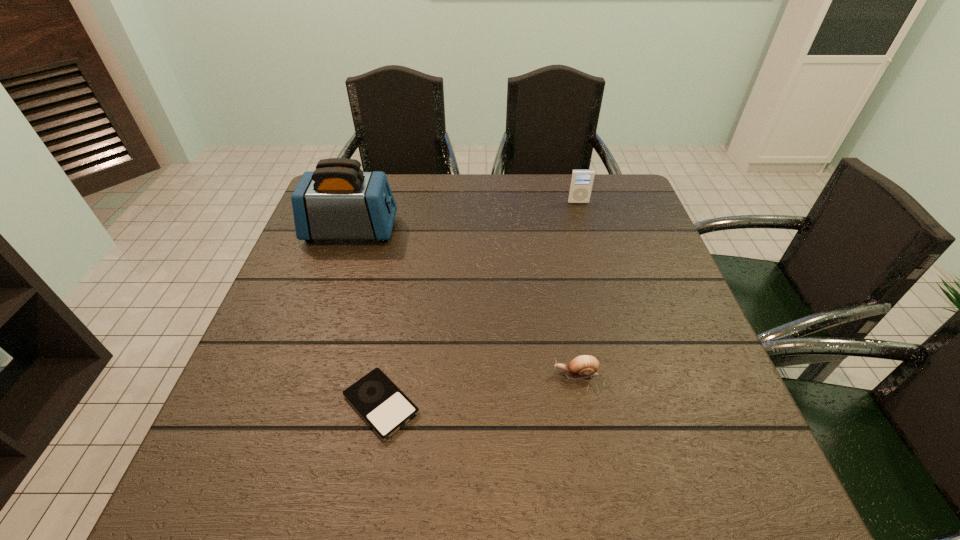
Identify the location of vacant space that satisfies the following two spatial constraints: 1. on the front-facing side of the farther iPod; 2. on the front-facing side of the escargot. This screenshot has height=540, width=960. (626, 374).

The image size is (960, 540). Identify the location of free spot that satisfies the following two spatial constraints: 1. on the front-facing side of the farthest object; 2. on the front-facing side of the third object from left to right. (626, 374).

Locate an element on the screen. This screenshot has width=960, height=540. free point that satisfies the following two spatial constraints: 1. on the front-facing side of the right iPod; 2. on the front-facing side of the escargot is located at coordinates (626, 374).

At what (x,y) coordinates should I click in order to perform the action: click on free region that satisfies the following two spatial constraints: 1. on the front-facing side of the third shortest object; 2. on the front-facing side of the escargot. Please return your answer as a coordinate pair (x, y). The height and width of the screenshot is (540, 960). Looking at the image, I should click on (626, 374).